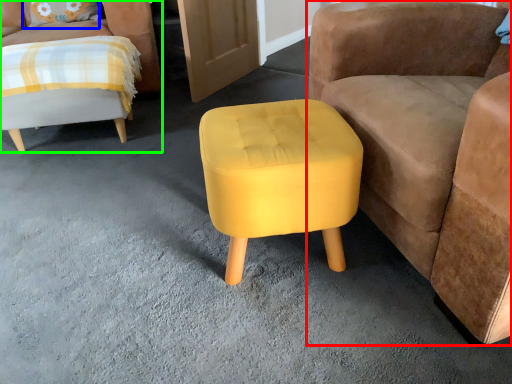
Question: Which is farther away from chair (highlighted by a red box)? pillow (highlighted by a blue box) or chair (highlighted by a green box)?

Choices:
 (A) pillow
 (B) chair

Answer: (A)